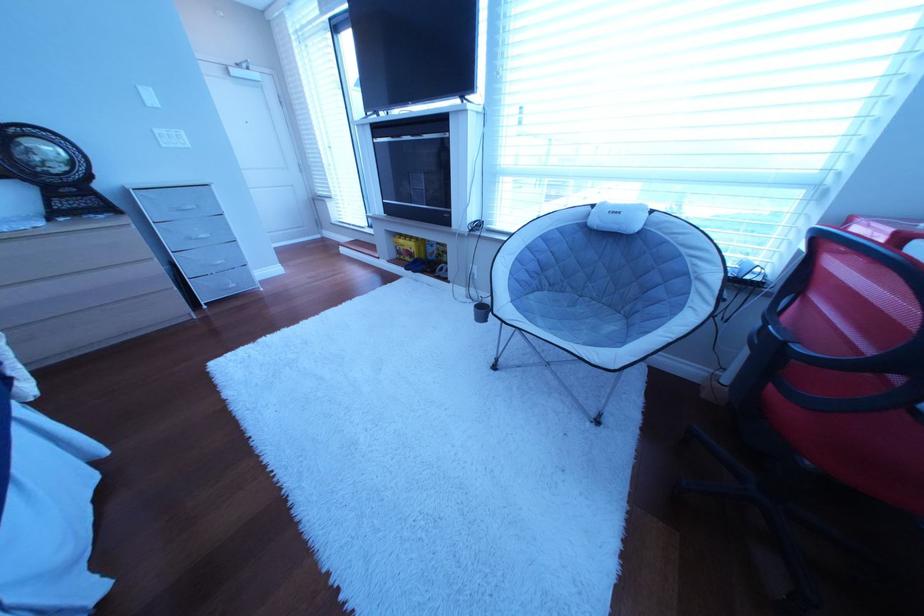
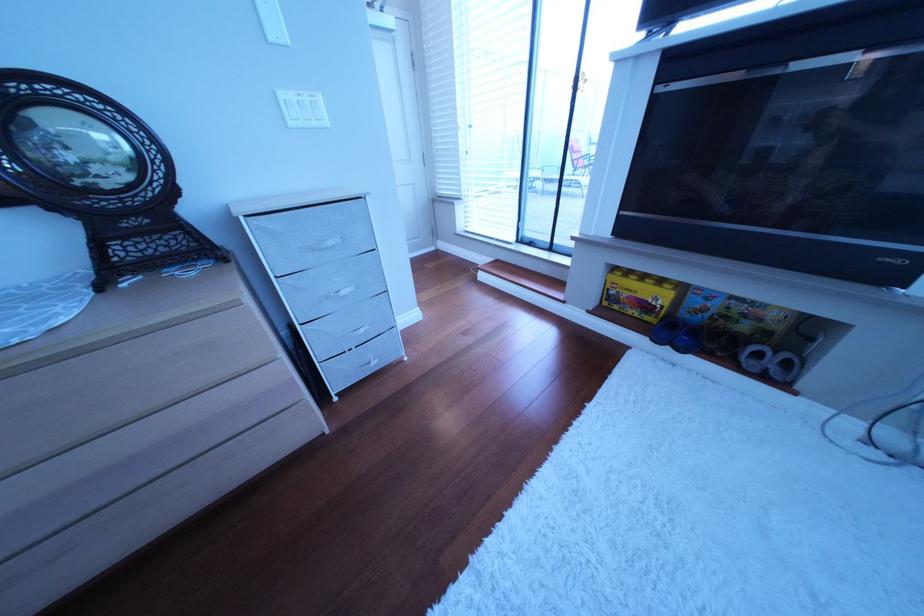
Locate, in the second image, the point that corresponds to (x=418, y=251) in the first image.

(640, 296)